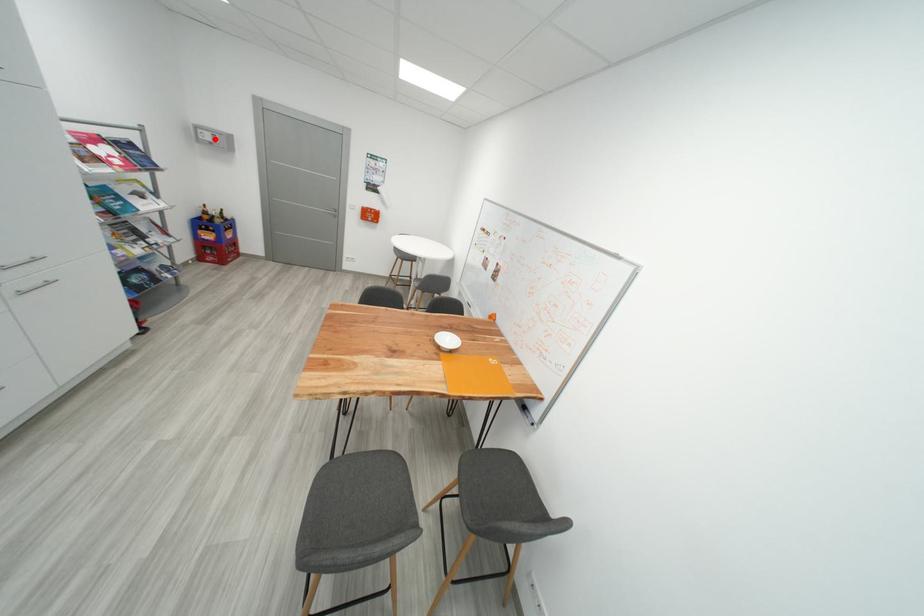
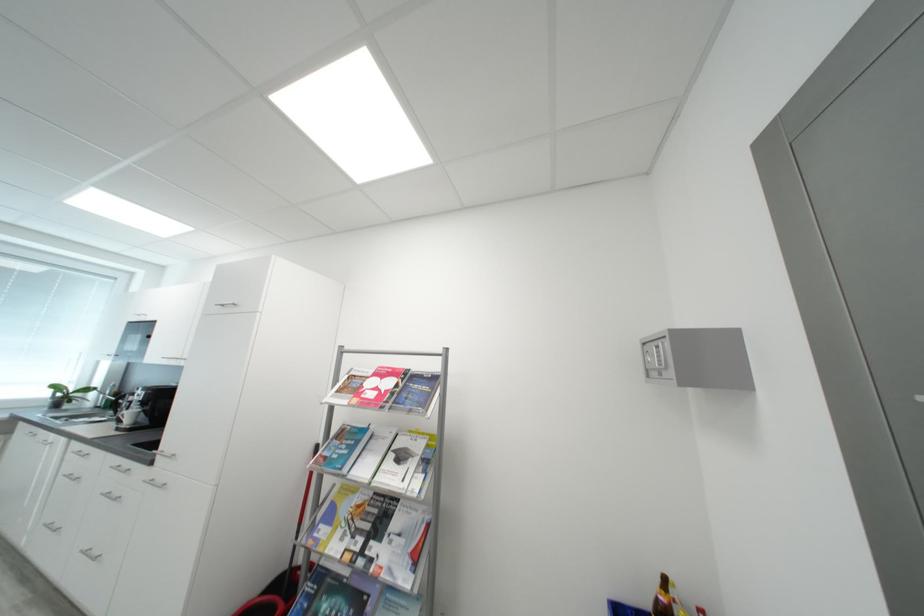
Where in the second image is the point corresponding to the highlighted location from the first image?

(660, 361)